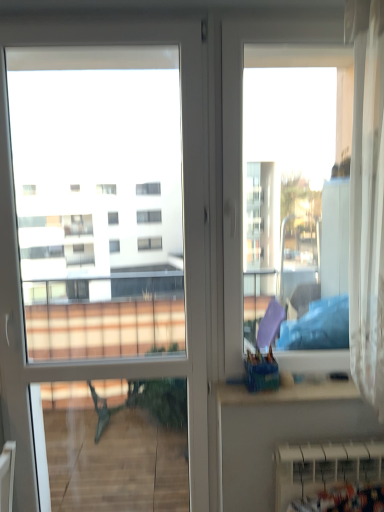
The height and width of the screenshot is (512, 384). What do you see at coordinates (324, 467) in the screenshot?
I see `white plastic radiator at lower right` at bounding box center [324, 467].

What are the coordinates of `white plastic radiator at lower right` in the screenshot? It's located at (324, 467).

What do you see at coordinates (184, 226) in the screenshot?
I see `white glossy door at left` at bounding box center [184, 226].

Looking at this image, what is the approximate height of white glossy door at left?

The height of white glossy door at left is 6.57 feet.

In order to click on white glossy door at left in this screenshot , I will do `click(184, 226)`.

What are the coordinates of `white plastic radiator at lower right` in the screenshot? It's located at (324, 467).

Would you say white plastic radiator at lower right is to the left or to the right of white glossy door at left in the picture?

Clearly, white plastic radiator at lower right is on the right of white glossy door at left in the image.

Between white plastic radiator at lower right and white glossy door at left, which one is positioned in front?

white glossy door at left is in front.

Which is behind, point (353, 467) or point (180, 46)?

Positioned behind is point (180, 46).

From the image's perspective, between white plastic radiator at lower right and white glossy door at left, who is located below?

From the image's view, white plastic radiator at lower right is below.

From a real-world perspective, is white plastic radiator at lower right positioned above or below white glossy door at left?

white plastic radiator at lower right is below white glossy door at left.

Is white plastic radiator at lower right thinner than white glossy door at left?

No, white plastic radiator at lower right is not thinner than white glossy door at left.

Considering the sizes of objects white plastic radiator at lower right and white glossy door at left in the image provided, who is shorter, white plastic radiator at lower right or white glossy door at left?

With less height is white plastic radiator at lower right.

Considering the relative sizes of white plastic radiator at lower right and white glossy door at left in the image provided, is white plastic radiator at lower right bigger than white glossy door at left?

No, white plastic radiator at lower right is not bigger than white glossy door at left.

Does white plastic radiator at lower right contain white glossy door at left?

Actually, white glossy door at left is outside white plastic radiator at lower right.

Is white plastic radiator at lower right positioned far away from white glossy door at left?

No, white plastic radiator at lower right is not far away from white glossy door at left.

Is white glossy door at left at the back of white plastic radiator at lower right?

No, white glossy door at left is not at the back of white plastic radiator at lower right.

Locate an element on the screen. door located above the white plastic radiator at lower right (from the image's perspective) is located at coordinates (184, 226).

Visually, is white glossy door at left positioned to the left or to the right of white plastic radiator at lower right?

From the image, it's evident that white glossy door at left is to the left of white plastic radiator at lower right.

Does white glossy door at left come behind white plastic radiator at lower right?

No, white glossy door at left is closer to the viewer.

Which is behind, point (203, 408) or point (287, 490)?

Positioned behind is point (203, 408).

From the image's perspective, which object appears higher, white glossy door at left or white plastic radiator at lower right?

white glossy door at left.

From a real-world perspective, who is located lower, white glossy door at left or white plastic radiator at lower right?

white plastic radiator at lower right is physically lower.

Can you confirm if white glossy door at left is thinner than white plastic radiator at lower right?

Yes, white glossy door at left is thinner than white plastic radiator at lower right.

Who is shorter, white glossy door at left or white plastic radiator at lower right?

white plastic radiator at lower right is shorter.

Between white glossy door at left and white plastic radiator at lower right, which one has larger size?

white glossy door at left.

Is white glossy door at left situated inside white plastic radiator at lower right or outside?

white glossy door at left is outside white plastic radiator at lower right.

Does white glossy door at left touch white plastic radiator at lower right?

No, white glossy door at left is not touching white plastic radiator at lower right.

Could you tell me if white glossy door at left is turned towards white plastic radiator at lower right?

No, white glossy door at left does not turn towards white plastic radiator at lower right.

How many degrees apart are the facing directions of white glossy door at left and white plastic radiator at lower right?

white glossy door at left and white plastic radiator at lower right are facing 1.94 degrees away from each other.

Find the location of a particular element. This screenshot has height=512, width=384. door to the left of white plastic radiator at lower right is located at coordinates (184, 226).

The height and width of the screenshot is (512, 384). What are the coordinates of `door above the white plastic radiator at lower right (from the image's perspective)` in the screenshot? It's located at click(x=184, y=226).

The image size is (384, 512). In order to click on radiator located below the white glossy door at left (from the image's perspective) in this screenshot , I will do `click(324, 467)`.